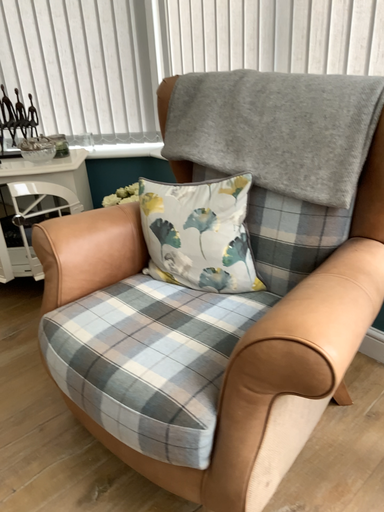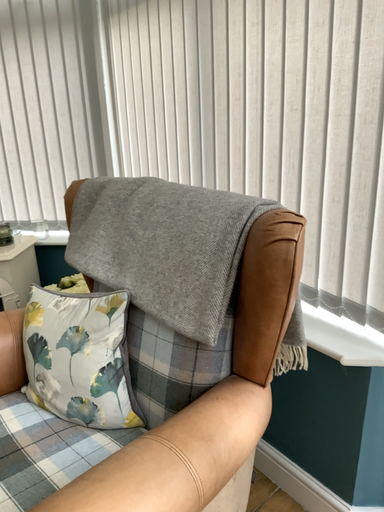
Question: Which way did the camera rotate in the video?

Choices:
 (A) rotated upward
 (B) rotated downward

Answer: (A)